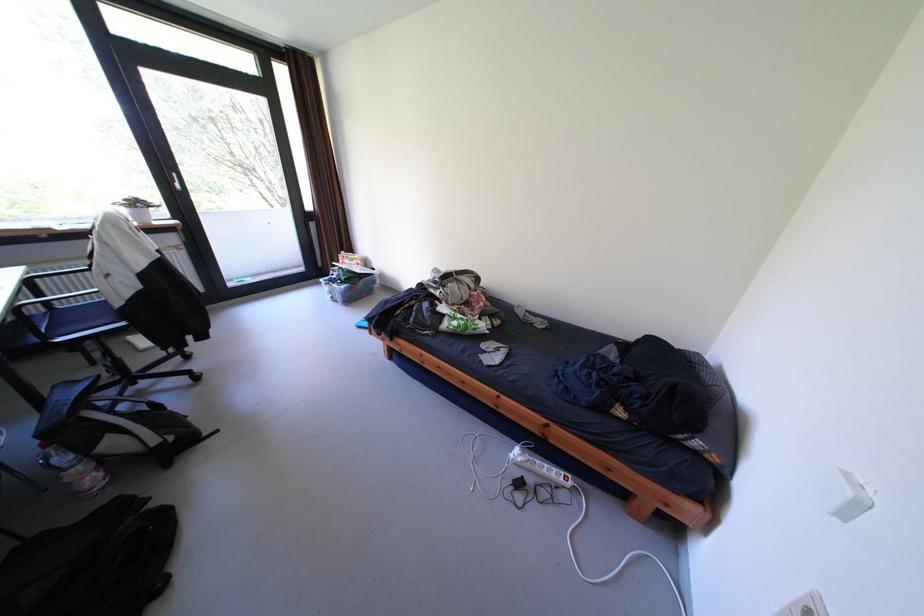
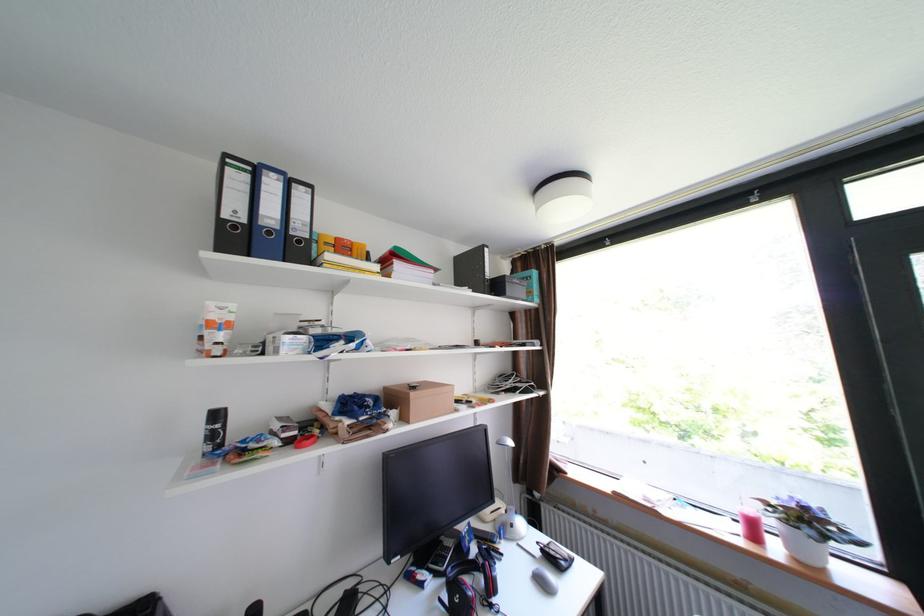
The point at (137,212) is marked in the first image. Where is the corresponding point in the second image?

(782, 523)